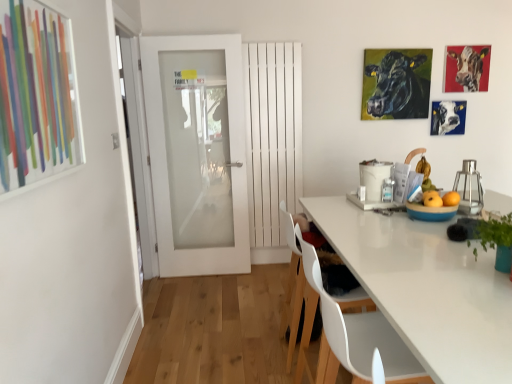
The height and width of the screenshot is (384, 512). Find the location of `free space above blue glossy bowl at right (from a real-world perspective)`. free space above blue glossy bowl at right (from a real-world perspective) is located at coordinates pos(431,201).